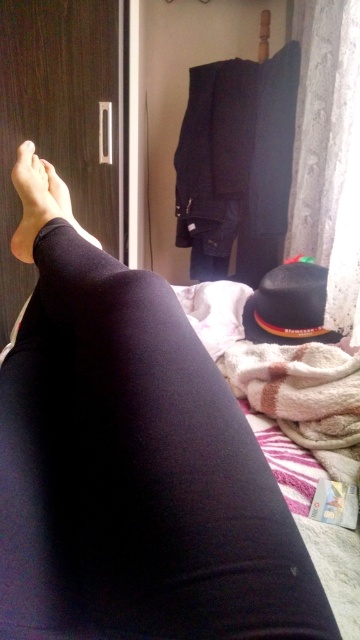
How far apart are black felt hat at lower right and black matte legging at lower left?

A distance of 21.75 inches exists between black felt hat at lower right and black matte legging at lower left.

Does black felt hat at lower right have a lesser height compared to black matte legging at lower left?

Incorrect, black felt hat at lower right's height does not fall short of black matte legging at lower left's.

I want to click on black felt hat at lower right, so click(x=289, y=307).

At what (x,y) coordinates should I click in order to perform the action: click on black felt hat at lower right. Please return your answer as a coordinate pair (x, y). The image size is (360, 640). Looking at the image, I should click on (289, 307).

Between point (340, 4) and point (300, 296), which one is positioned behind?

The point (340, 4) is more distant.

Consider the image. Is white textured curtain at right below black felt hat at lower right?

Actually, white textured curtain at right is above black felt hat at lower right.

Does point (353, 83) come closer to viewer compared to point (297, 308)?

No, (353, 83) is behind (297, 308).

Where is `white textured curtain at right`? white textured curtain at right is located at coordinates (329, 154).

Who is taller, black matte leggings at lower left or white textured curtain at right?

With more height is white textured curtain at right.

Between black matte leggings at lower left and white textured curtain at right, which one appears on the right side from the viewer's perspective?

white textured curtain at right

Which is behind, point (257, 531) or point (348, 26)?

Point (348, 26)

Locate an element on the screen. The image size is (360, 640). black matte leggings at lower left is located at coordinates (135, 474).